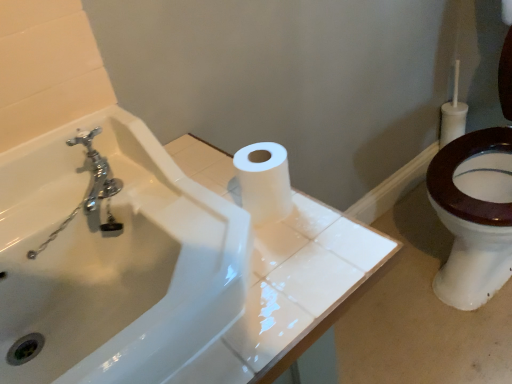
Question: Is white glossy sink at upper center bigger or smaller than white matte toilet paper at center?

Choices:
 (A) big
 (B) small

Answer: (A)

Question: Is point (26, 157) closer or farther from the camera than point (263, 221)?

Choices:
 (A) farther
 (B) closer

Answer: (A)

Question: Visually, is white glossy sink at upper center positioned to the left or to the right of white matte toilet paper at center?

Choices:
 (A) right
 (B) left

Answer: (B)

Question: Considering the positions of point (260, 215) and point (165, 281), is point (260, 215) closer or farther from the camera than point (165, 281)?

Choices:
 (A) farther
 (B) closer

Answer: (B)

Question: From the image's perspective, is white matte toilet paper at center positioned above or below white glossy sink at upper center?

Choices:
 (A) below
 (B) above

Answer: (B)

Question: Considering their positions, is white matte toilet paper at center located in front of or behind white glossy sink at upper center?

Choices:
 (A) front
 (B) behind

Answer: (B)

Question: Is white matte toilet paper at center bigger or smaller than white glossy sink at upper center?

Choices:
 (A) big
 (B) small

Answer: (B)